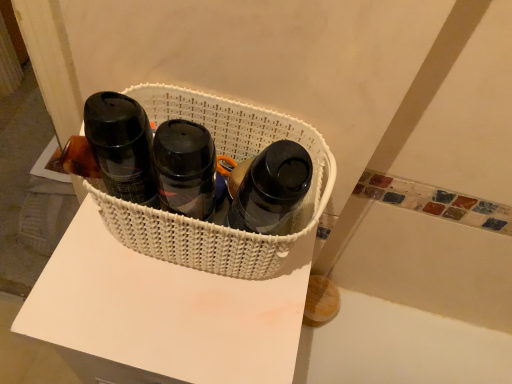
Find the location of `empty space that is ontop of white woven basket at center`. empty space that is ontop of white woven basket at center is located at coordinates (162, 301).